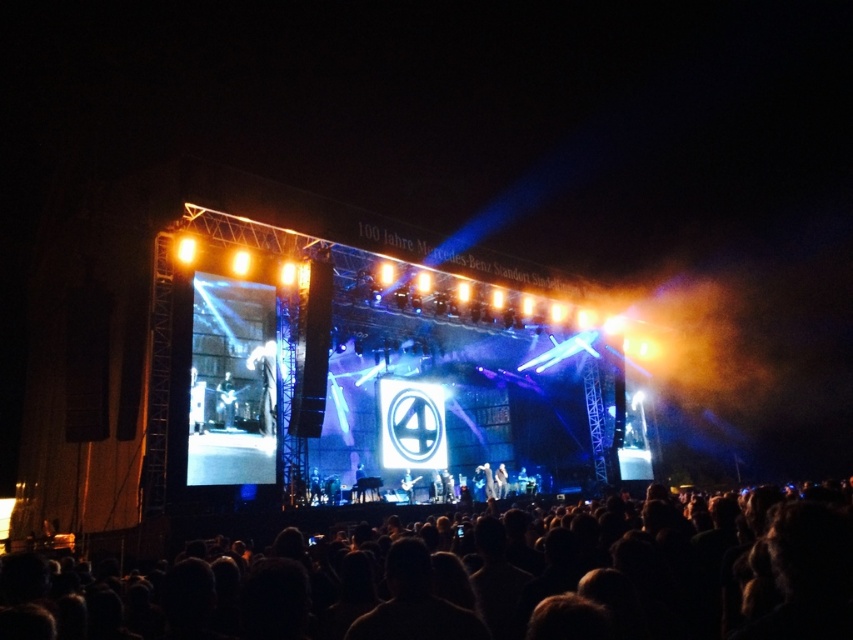
You are standing at the concert venue and want to know the distance from your current position to the point marked at coordinates [723,512] on the stage. Can you estimate how far you are from that point?

The distance between you and the point marked at coordinates [723,512] is 171.08 feet.

You are a stagehand preparing to adjust the lighting for the concert. You need to ensure that the shiny black guitar at center is fully visible to the audience. Considering the black matte crowd at lower center, which is taller than the guitar, what adjustment should you make to the lighting setup?

Since the black matte crowd at lower center is taller than the shiny black guitar at center, you should aim the lighting downward to illuminate the guitar while avoiding casting shadows from the crowd onto it.